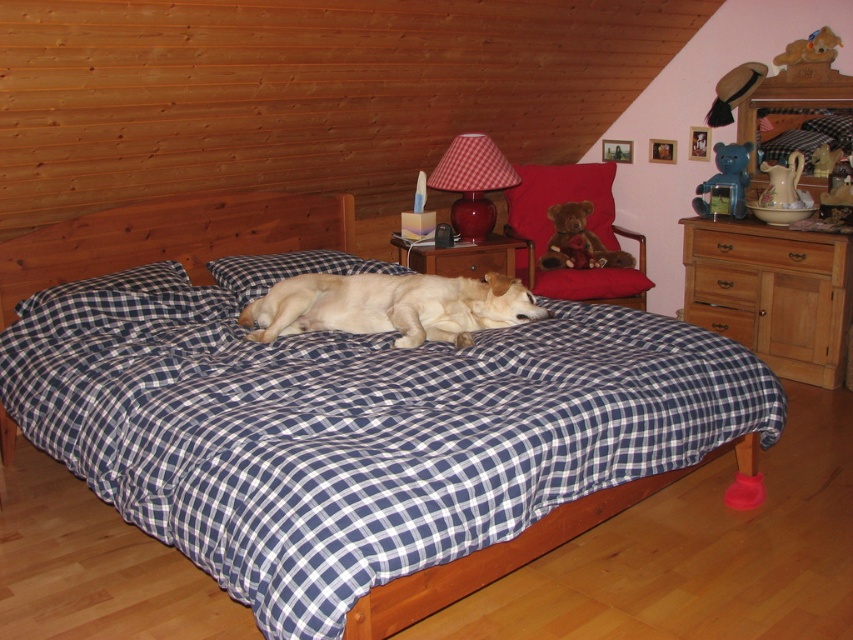
Who is lower down, wooden drawer at center right or brown wooden drawer at center?

brown wooden drawer at center is lower down.

Can you confirm if wooden drawer at center right is bigger than brown wooden drawer at center?

No.

Locate an element on the screen. This screenshot has height=640, width=853. wooden drawer at center right is located at coordinates (724, 284).

Is point (698, 316) less distant than point (500, 257)?

No.

Who is more distant from viewer, (714, 330) or (476, 273)?

The point (714, 330) is more distant.

What are the coordinates of `brown wooden drawer at center` in the screenshot? It's located at (722, 321).

Does light yellow fur at center have a greater width compared to wooden drawer at center right?

Correct, the width of light yellow fur at center exceeds that of wooden drawer at center right.

Is the position of light yellow fur at center more distant than that of wooden drawer at center right?

That is False.

Find the location of a particular element. Image resolution: width=853 pixels, height=640 pixels. light yellow fur at center is located at coordinates (392, 307).